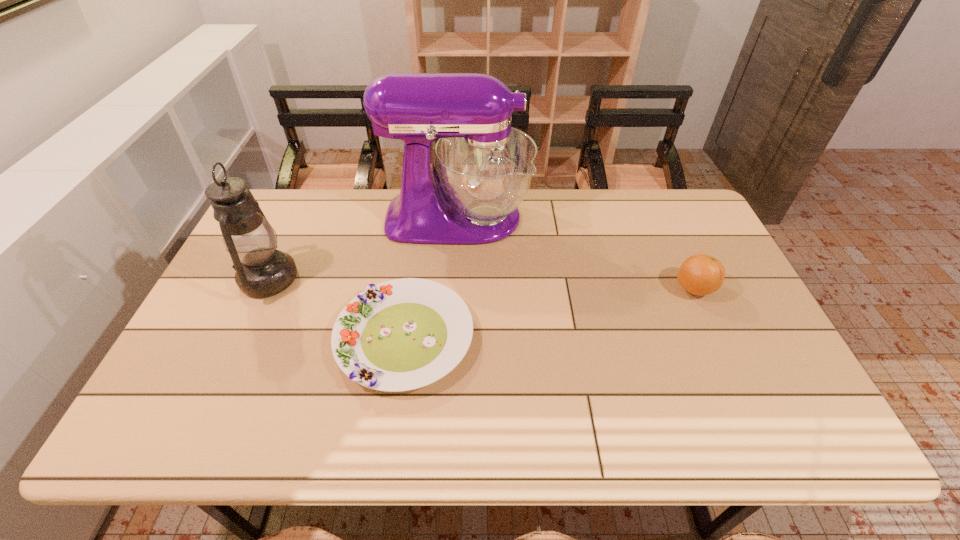
Where is `the tallest object`? the tallest object is located at coordinates (485, 167).

The width and height of the screenshot is (960, 540). In order to click on mixer in this screenshot , I will do `click(485, 167)`.

Identify the location of the leftmost object. The width and height of the screenshot is (960, 540). (262, 271).

You are a GUI agent. You are given a task and a screenshot of the screen. Output one action in this format:
    pyautogui.click(x=<x>, y=<y>)
    Task: Click on the second tallest object
    
    Given the screenshot: What is the action you would take?
    pyautogui.click(x=262, y=271)

Image resolution: width=960 pixels, height=540 pixels. Identify the location of the rightmost object. (700, 274).

The image size is (960, 540). Find the location of `the second shortest object`. the second shortest object is located at coordinates (700, 274).

The height and width of the screenshot is (540, 960). Find the location of `salad plate`. salad plate is located at coordinates (403, 334).

You are a GUI agent. You are given a task and a screenshot of the screen. Output one action in this format:
    pyautogui.click(x=<x>, y=<y>)
    Task: Click on the vacant area located at the bowl opening of the farthest object
    
    Given the screenshot: What is the action you would take?
    pyautogui.click(x=585, y=218)

The image size is (960, 540). In order to click on free space located 0.160m on the back of the oil lamp in this screenshot , I will do `click(296, 221)`.

The image size is (960, 540). In order to click on vacant space located on the left of the orange in this screenshot , I will do `click(578, 289)`.